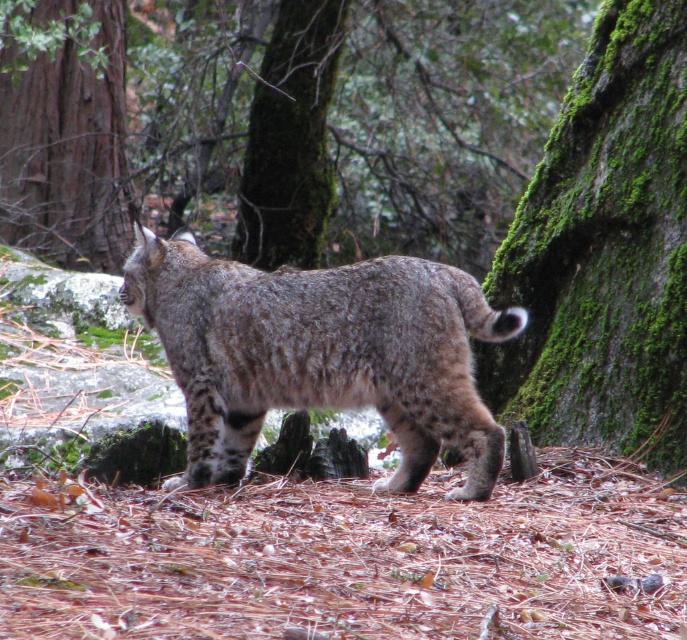
Does brown rough tree trunk at upper left have a larger size compared to green mossy tree trunk at center?

Yes, brown rough tree trunk at upper left is bigger than green mossy tree trunk at center.

Is the position of brown rough tree trunk at upper left less distant than that of green mossy tree trunk at center?

Yes, brown rough tree trunk at upper left is in front of green mossy tree trunk at center.

Consider the image. Who is more distant from viewer, (25, 136) or (306, 61)?

The point (25, 136) is more distant.

Where is `brown rough tree trunk at upper left`? The height and width of the screenshot is (640, 687). brown rough tree trunk at upper left is located at coordinates (65, 132).

Who is positioned more to the left, green mossy bark at right or brown rough tree trunk at upper left?

brown rough tree trunk at upper left is more to the left.

Can you confirm if green mossy bark at right is taller than brown rough tree trunk at upper left?

Incorrect, green mossy bark at right's height is not larger of brown rough tree trunk at upper left's.

Is point (631, 298) farther from camera compared to point (67, 147)?

That is False.

Find the location of a particular element. Image resolution: width=687 pixels, height=640 pixels. green mossy bark at right is located at coordinates (602, 250).

Who is taller, green mossy bark at right or green mossy tree trunk at center?

green mossy tree trunk at center

From the picture: Is green mossy bark at right behind green mossy tree trunk at center?

No.

Between point (576, 218) and point (291, 237), which one is positioned in front?

Point (576, 218) is in front.

The width and height of the screenshot is (687, 640). I want to click on green mossy bark at right, so click(x=602, y=250).